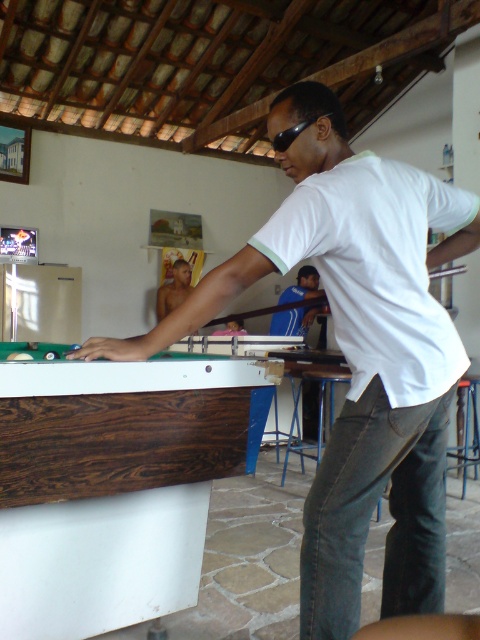
Question: Is dark wood billiard table at left thinner than black plastic goggles at center?

Choices:
 (A) no
 (B) yes

Answer: (A)

Question: Which point is farther from the camera taking this photo?

Choices:
 (A) (311, 284)
 (B) (173, 269)

Answer: (B)

Question: Considering the real-world distances, which object is farthest from the black plastic goggles at center?

Choices:
 (A) shiny skin torso at center
 (B) blue fabric shirt at center
 (C) dark wood billiard table at left

Answer: (A)

Question: Observing the image, what is the correct spatial positioning of dark wood billiard table at left in reference to shiny skin torso at center?

Choices:
 (A) below
 (B) above

Answer: (A)

Question: Which object is closer to the camera taking this photo?

Choices:
 (A) dark wood billiard table at left
 (B) shiny skin torso at center

Answer: (A)

Question: Can you confirm if dark wood billiard table at left is thinner than shiny skin torso at center?

Choices:
 (A) no
 (B) yes

Answer: (A)